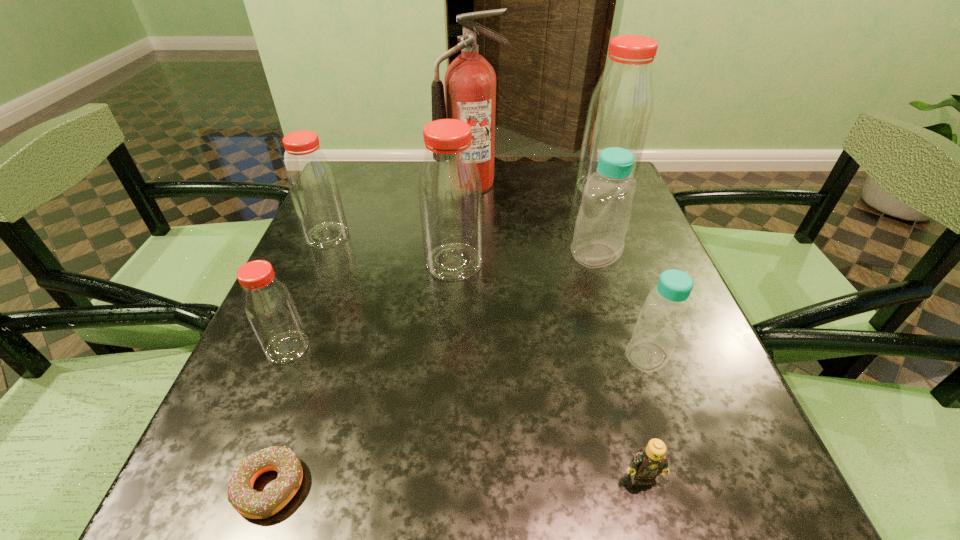
Locate an element on the screen. This screenshot has height=540, width=960. vacant space at the far edge is located at coordinates (543, 205).

Locate an element on the screen. This screenshot has height=540, width=960. vacant point at the near edge is located at coordinates (595, 479).

Locate an element on the screen. Image resolution: width=960 pixels, height=540 pixels. vacant region at the left edge is located at coordinates (380, 224).

The image size is (960, 540). In the image, there is a desktop. What are the coordinates of `vacant space at the far left corner` in the screenshot? It's located at (360, 183).

Identify the location of blank region between the nearest red bottle and the red fire extinguisher. The height and width of the screenshot is (540, 960). (379, 265).

Identify the location of free spot between the shortest object and the nearest red bottle. The height and width of the screenshot is (540, 960). (279, 417).

This screenshot has width=960, height=540. What are the coordinates of `vacant space in between the fourth bottle from right to left and the smaller blue bottle` in the screenshot? It's located at (551, 309).

Find the location of `free space that is in between the fifth shortest bottle and the doughnut`. free space that is in between the fifth shortest bottle and the doughnut is located at coordinates (362, 374).

The width and height of the screenshot is (960, 540). Identify the location of free space between the nearest red bottle and the shortest object. (279, 417).

Locate an element on the screen. vacant space in between the farther blue bottle and the nearest red bottle is located at coordinates (442, 301).